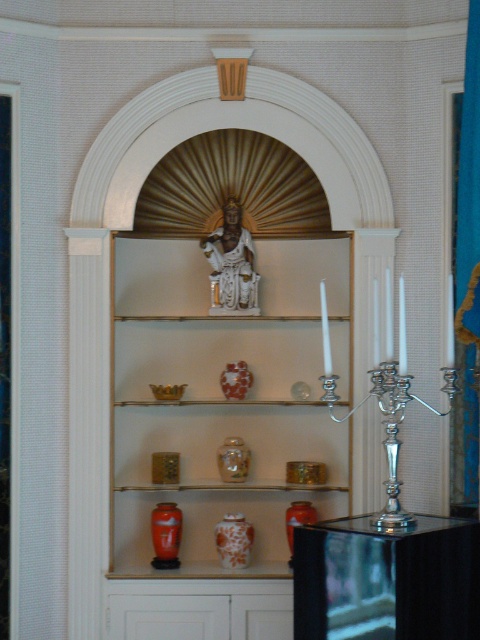
Which is in front, point (393, 406) or point (286, 524)?

Point (393, 406) is more forward.

Does point (324, 388) lie behind point (298, 502)?

That is False.

Measure the distance between silver metallic candelabra at right and camera.

silver metallic candelabra at right and camera are 4.45 meters apart from each other.

Where is `silver metallic candelabra at right`? The width and height of the screenshot is (480, 640). silver metallic candelabra at right is located at coordinates (388, 388).

Does white glossy statue at upper center have a lesser height compared to orange glossy vase at center?

In fact, white glossy statue at upper center may be taller than orange glossy vase at center.

Consider the image. Who is higher up, white glossy statue at upper center or orange glossy vase at center?

white glossy statue at upper center is above.

Between point (274, 444) and point (307, 520), which one is positioned in front?

Point (307, 520) is in front.

Locate an element on the screen. white glossy statue at upper center is located at coordinates (224, 397).

Is point (217, 540) farther from viewer compared to point (300, 520)?

That is True.

Does porcelain vase at center come behind orange glossy vase at center?

Yes.

This screenshot has width=480, height=640. In order to click on porcelain vase at center in this screenshot , I will do (x=233, y=540).